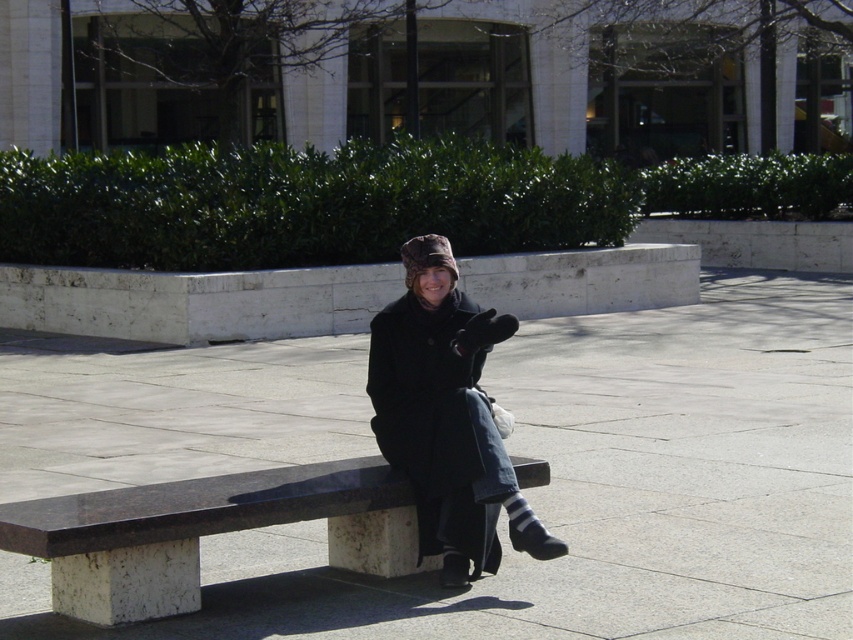
You are standing at the point marked by coordinates point (206, 532). What object are you standing on?

The point marked by coordinates point (206, 532) marks dark brown polished wood bench at center.

You are standing at the point with coordinates point [538,532] and want to walk to the point with coordinates point [123,531]. Which direction should you move to reach your destination?

You should move forward because point [123,531] is in front of point [538,532].

Looking at this image, you are standing at the origin point of the coordinate system in this image. The dark brown polished wood bench at center is located at point 0.833, 0.243. If you want to walk straight towards the bench, in which direction should you move?

To move towards the dark brown polished wood bench at center located at coordinates (206, 532) from the origin, you should move in the positive x and positive y direction since both coordinates are greater than zero.